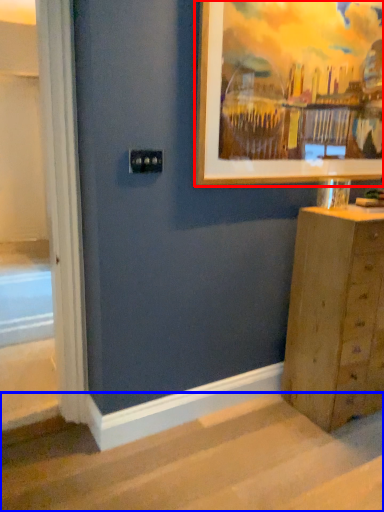
Question: Among these objects, which one is farthest to the camera, picture frame (highlighted by a red box) or stairwell (highlighted by a blue box)?

Choices:
 (A) picture frame
 (B) stairwell

Answer: (A)